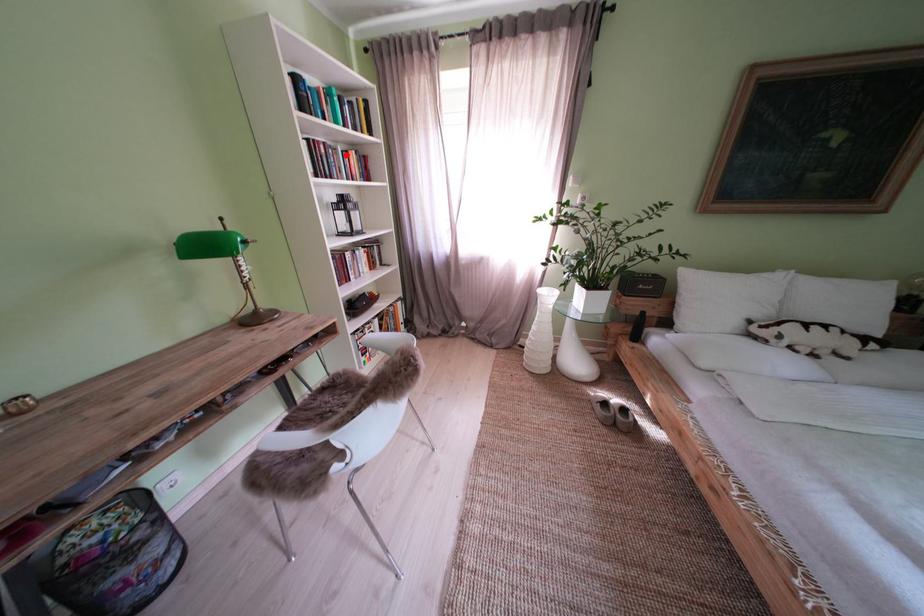
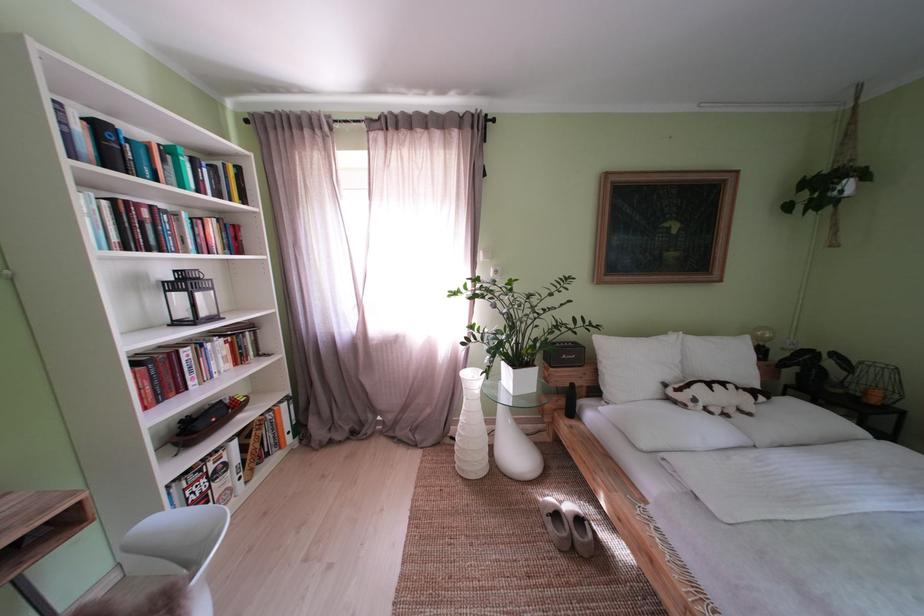
Where in the second image is the point corresponding to the highlighted location from the first image?

(188, 220)